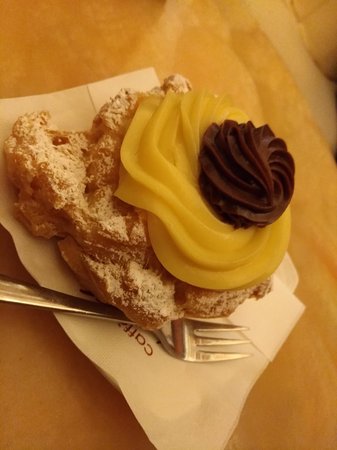
In order to click on napkin to wipe mouth with in this screenshot , I will do `click(167, 378)`.